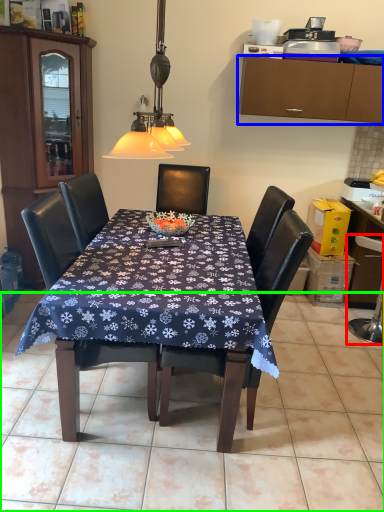
Question: Considering the real-world distances, which object is farthest from swivel chair (highlighted by a red box)? cabinetry (highlighted by a blue box) or tile (highlighted by a green box)?

Choices:
 (A) cabinetry
 (B) tile

Answer: (A)